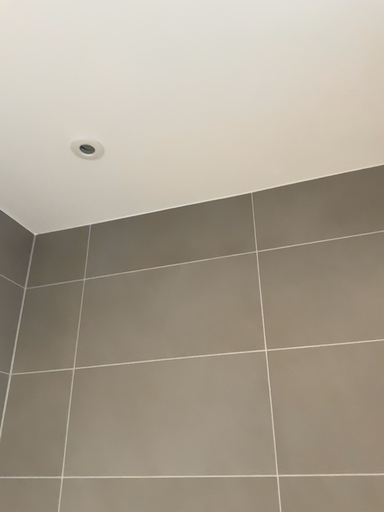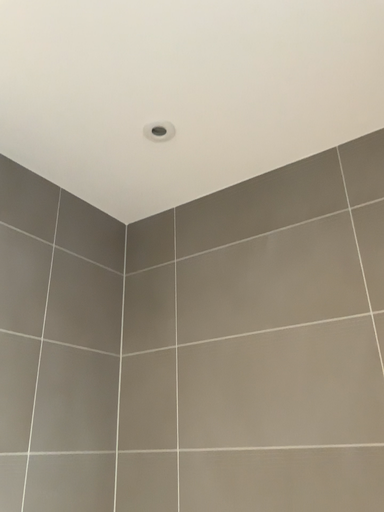
Question: How did the camera likely rotate when shooting the video?

Choices:
 (A) rotated left
 (B) rotated right

Answer: (A)